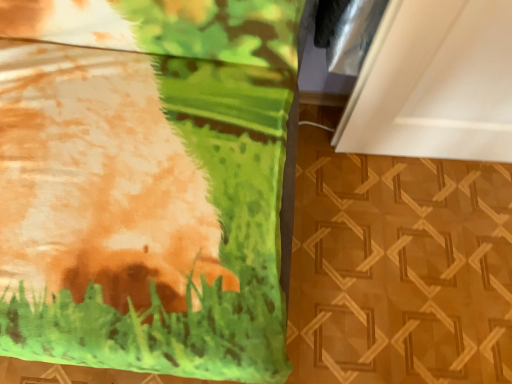
Where is `free point to the right of matte green blanket at upper left`? free point to the right of matte green blanket at upper left is located at coordinates (385, 251).